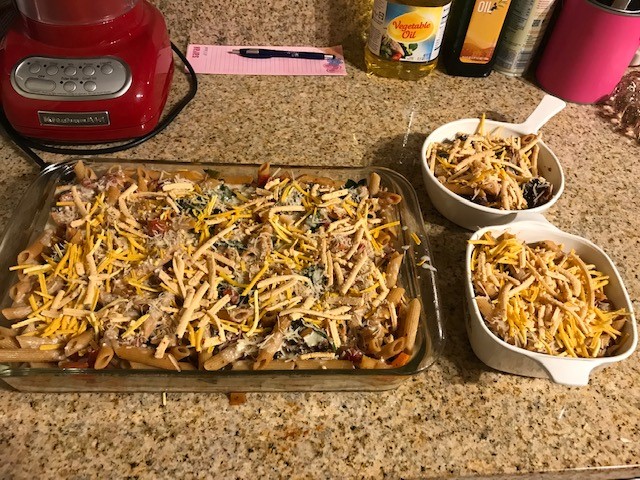
Where is `pen`? pen is located at coordinates (260, 53).